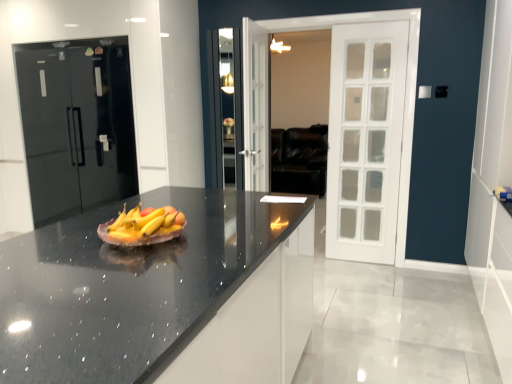
Question: From the image's perspective, is black granite countertop at center below glossy black refrigerator at left?

Choices:
 (A) no
 (B) yes

Answer: (B)

Question: Considering the relative sizes of black granite countertop at center and glossy black refrigerator at left in the image provided, is black granite countertop at center smaller than glossy black refrigerator at left?

Choices:
 (A) yes
 (B) no

Answer: (B)

Question: Is black granite countertop at center thinner than glossy black refrigerator at left?

Choices:
 (A) no
 (B) yes

Answer: (A)

Question: From the image's perspective, would you say black granite countertop at center is positioned over glossy black refrigerator at left?

Choices:
 (A) no
 (B) yes

Answer: (A)

Question: Are black granite countertop at center and glossy black refrigerator at left located far from each other?

Choices:
 (A) yes
 (B) no

Answer: (A)

Question: Is black granite countertop at center located outside glossy black refrigerator at left?

Choices:
 (A) yes
 (B) no

Answer: (A)

Question: Is matte ceramic grapefruit at center to the left of white door at right from the viewer's perspective?

Choices:
 (A) no
 (B) yes

Answer: (B)

Question: Is matte ceramic grapefruit at center positioned before white door at right?

Choices:
 (A) no
 (B) yes

Answer: (B)

Question: From a real-world perspective, is matte ceramic grapefruit at center physically above white door at right?

Choices:
 (A) no
 (B) yes

Answer: (A)

Question: Is matte ceramic grapefruit at center oriented away from white door at right?

Choices:
 (A) no
 (B) yes

Answer: (A)

Question: Is matte ceramic grapefruit at center thinner than white door at right?

Choices:
 (A) yes
 (B) no

Answer: (B)

Question: Are matte ceramic grapefruit at center and white door at right making contact?

Choices:
 (A) yes
 (B) no

Answer: (B)

Question: Is black granite countertop at center outside of matte ceramic grapefruit at center?

Choices:
 (A) yes
 (B) no

Answer: (A)